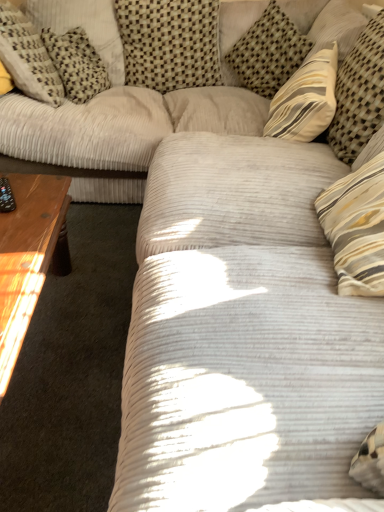
Question: Is woven beige pillow at upper center, the 3th pillow from the right, inside or outside of light brown wooden coffee table at left?

Choices:
 (A) outside
 (B) inside

Answer: (A)

Question: From the image's perspective, is woven beige pillow at upper center, the third pillow from the left, located above or below light brown wooden coffee table at left?

Choices:
 (A) above
 (B) below

Answer: (A)

Question: Which object is the farthest from the light brown wooden coffee table at left?

Choices:
 (A) woven beige pillow at upper center, the third pillow from the left
 (B) white corduroy pillow at upper left, marked as the first pillow in a left-to-right arrangement
 (C) checkered fabric pillow at upper left, which is the 2th pillow in left-to-right order
 (D) striped fabric pillow at upper right, the 1th pillow when ordered from right to left
 (E) striped fabric pillow at upper right, which is the 4th pillow in left-to-right order

Answer: (E)

Question: Considering the real-world distances, which object is closest to the striped fabric pillow at upper right, the 5th pillow in the left-to-right sequence?

Choices:
 (A) white corduroy pillow at upper left, which is counted as the 5th pillow, starting from the right
 (B) woven beige pillow at upper center, the third pillow from the left
 (C) striped fabric pillow at upper right, which is counted as the 2th pillow, starting from the right
 (D) checkered fabric pillow at upper left, which ranks as the fourth pillow in right-to-left order
 (E) light brown wooden coffee table at left

Answer: (C)